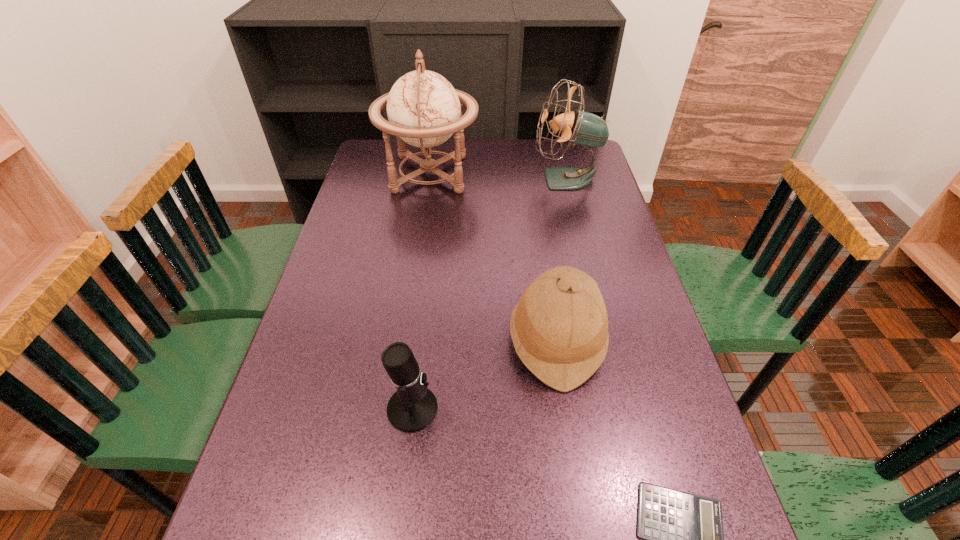
In the image, there is a desktop. Where is `free region at the left edge`? free region at the left edge is located at coordinates (319, 461).

Locate an element on the screen. Image resolution: width=960 pixels, height=540 pixels. free region at the right edge is located at coordinates (634, 373).

Locate an element on the screen. The image size is (960, 540). free space at the far right corner is located at coordinates (558, 145).

This screenshot has width=960, height=540. I want to click on vacant area between the hat and the fan, so click(x=561, y=259).

Locate an element on the screen. Image resolution: width=960 pixels, height=540 pixels. vacant space in between the hat and the fan is located at coordinates (561, 259).

This screenshot has width=960, height=540. Find the location of `free space between the hat and the globe`. free space between the hat and the globe is located at coordinates (493, 257).

This screenshot has width=960, height=540. I want to click on vacant space that is in between the second shortest object and the fourth shortest object, so click(490, 294).

This screenshot has width=960, height=540. Identify the location of empty space that is in between the hat and the second tallest object. (561, 259).

Select which object is the third closest to the hat. Please provide its 2D coordinates. Your answer should be formatted as a tuple, i.e. [(x, y)], where the tuple contains the x and y coordinates of a point satisfying the conditions above.

[(424, 110)]

I want to click on object that stands as the fourth closest to the fan, so click(683, 533).